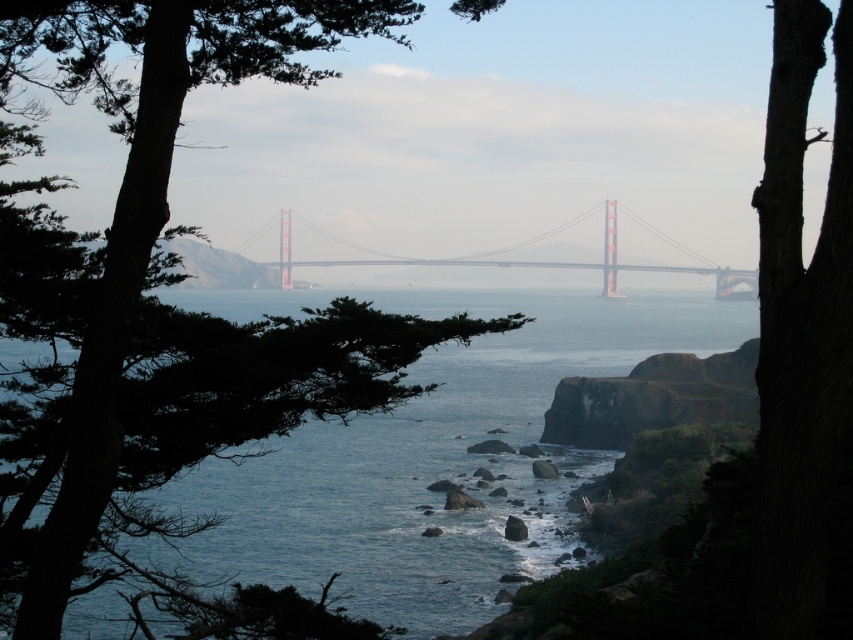
You are a photographer standing on the shore and want to capture the painted steel bridge at center in the background while including the blue water at center in the foreground. Given that your camera has a depth of field range of 60 meters, will both the bridge and the water be in focus?

The blue water at center is 63.83 meters from the painted steel bridge at center. Since the depth of field can only cover 60 meters, the distance between them exceeds the camera settings. Therefore, both the blue water at center and the painted steel bridge at center cannot be in focus simultaneously.